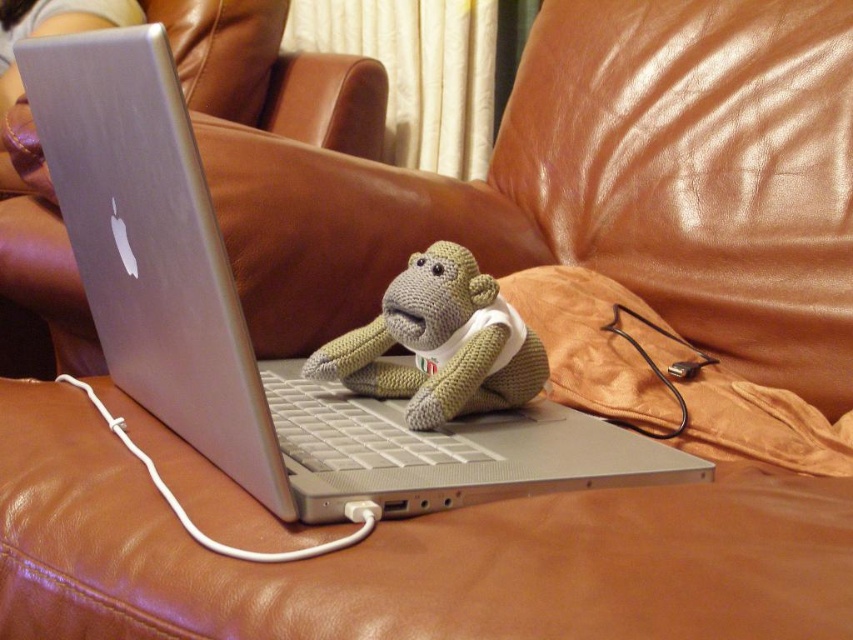
You are trying to place a small decorative item on the couch. The silver metallic laptop at center is currently occupying space. Can the knitted beige monkey at center fit on the remaining space of the couch without overlapping the laptop?

The silver metallic laptop at center is much taller than the knitted beige monkey at center. Since the laptop is taller, there might still be enough space on the couch for the monkey to be placed without overlapping, but the exact fit depends on the horizontal space available.

You are trying to place a new mouse on the laptop. Since the monkey is blocking part of the keyboard, where should you place the mouse relative to the knitted beige monkey at center and the silver metallic laptop at center?

The silver metallic laptop at center is positioned on the left side of knitted beige monkey at center, so you should place the mouse on the right side of the silver metallic laptop at center, opposite to where the monkey is blocking the keyboard.